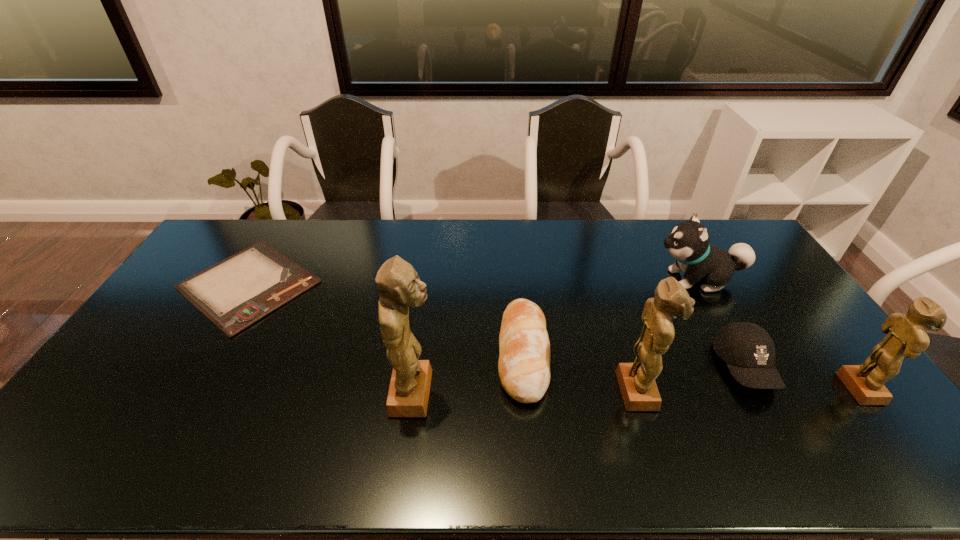
Where is `vacant space located 0.110m on the front-facing side of the leftmost figurine`? Image resolution: width=960 pixels, height=540 pixels. vacant space located 0.110m on the front-facing side of the leftmost figurine is located at coordinates (478, 393).

The image size is (960, 540). I want to click on vacant point located 0.380m on the front-facing side of the second figurine from left to right, so click(x=802, y=390).

The image size is (960, 540). Find the location of `free space located 0.170m on the front of the clipboard`. free space located 0.170m on the front of the clipboard is located at coordinates (188, 387).

You are a GUI agent. You are given a task and a screenshot of the screen. Output one action in this format:
    pyautogui.click(x=<x>, y=<y>)
    Task: Click on the free space located at the face of the fourth shortest object
    Image resolution: width=960 pixels, height=540 pixels.
    Given the screenshot: What is the action you would take?
    pyautogui.click(x=599, y=279)

This screenshot has width=960, height=540. I want to click on vacant space located at the face of the fourth shortest object, so pos(559,279).

You are a GUI agent. You are given a task and a screenshot of the screen. Output one action in this format:
    pyautogui.click(x=<x>, y=<y>)
    Task: Click on the vacant space situated at the face of the fourth shortest object
    The width and height of the screenshot is (960, 540).
    Given the screenshot: What is the action you would take?
    pyautogui.click(x=576, y=279)

Where is `vacant area located on the left of the fifth object from right to left`? This screenshot has width=960, height=540. vacant area located on the left of the fifth object from right to left is located at coordinates (403, 353).

Find the location of a particular element. The height and width of the screenshot is (540, 960). object that is at the far edge is located at coordinates (236, 292).

Image resolution: width=960 pixels, height=540 pixels. Identify the location of bread present at the near edge. (524, 361).

What are the coordinates of `baseball cap present at the near edge` in the screenshot? It's located at (749, 351).